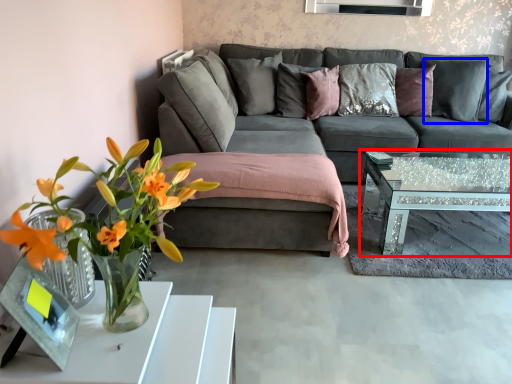
Question: Which point is further to the camera, coffee table (highlighted by a red box) or pillow (highlighted by a blue box)?

Choices:
 (A) coffee table
 (B) pillow

Answer: (B)